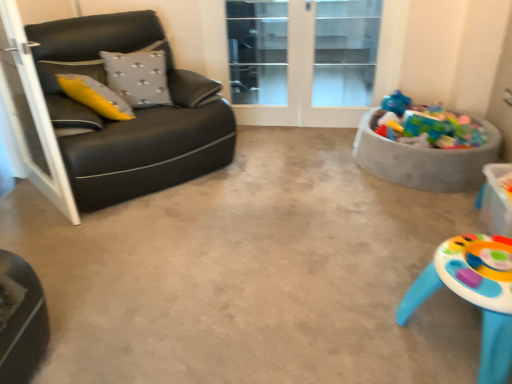
Where is `free spot behind matte plastic table at lower right`? The width and height of the screenshot is (512, 384). free spot behind matte plastic table at lower right is located at coordinates (389, 241).